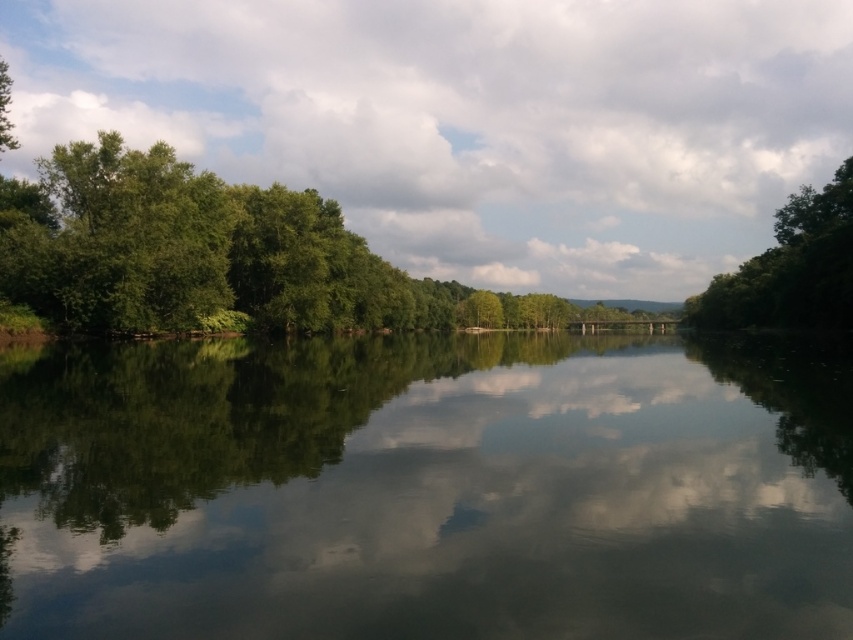
Does green reflective water at center have a greater width compared to green leafy tree at upper center?

Yes.

The height and width of the screenshot is (640, 853). I want to click on green reflective water at center, so click(426, 486).